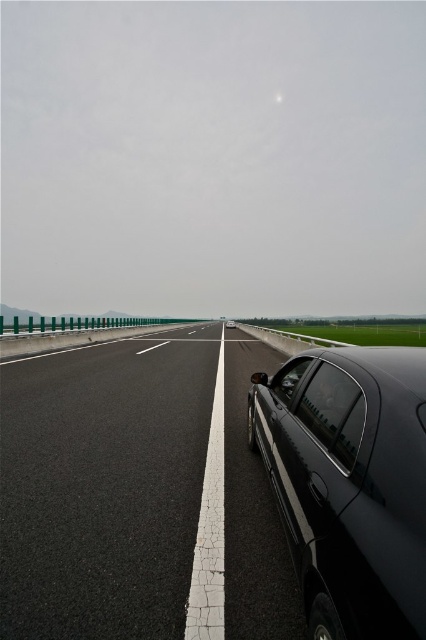
Consider the image. Who is taller, glossy black car at right or transparent glass window at center?

Standing taller between the two is glossy black car at right.

Based on the photo, can you confirm if glossy black car at right is positioned to the right of transparent glass window at center?

In fact, glossy black car at right is to the left of transparent glass window at center.

Which is in front, point (319, 506) or point (284, 387)?

Point (319, 506)

You are a GUI agent. You are given a task and a screenshot of the screen. Output one action in this format:
    pyautogui.click(x=<x>, y=<y>)
    Task: Click on the glossy black car at right
    Image resolution: width=426 pixels, height=640 pixels.
    Given the screenshot: What is the action you would take?
    tap(351, 486)

Between transparent glass window at lower right and glossy black car at center, which one appears on the right side from the viewer's perspective?

Positioned to the right is glossy black car at center.

Based on the photo, does transparent glass window at lower right have a smaller size compared to glossy black car at center?

Correct, transparent glass window at lower right occupies less space than glossy black car at center.

What do you see at coordinates (333, 412) in the screenshot?
I see `transparent glass window at lower right` at bounding box center [333, 412].

Identify the location of transparent glass window at lower right. (333, 412).

Where is `black asphalt highway at center`? black asphalt highway at center is located at coordinates (134, 492).

Describe the element at coordinates (134, 492) in the screenshot. The width and height of the screenshot is (426, 640). I see `black asphalt highway at center` at that location.

The width and height of the screenshot is (426, 640). In order to click on black asphalt highway at center in this screenshot , I will do `click(134, 492)`.